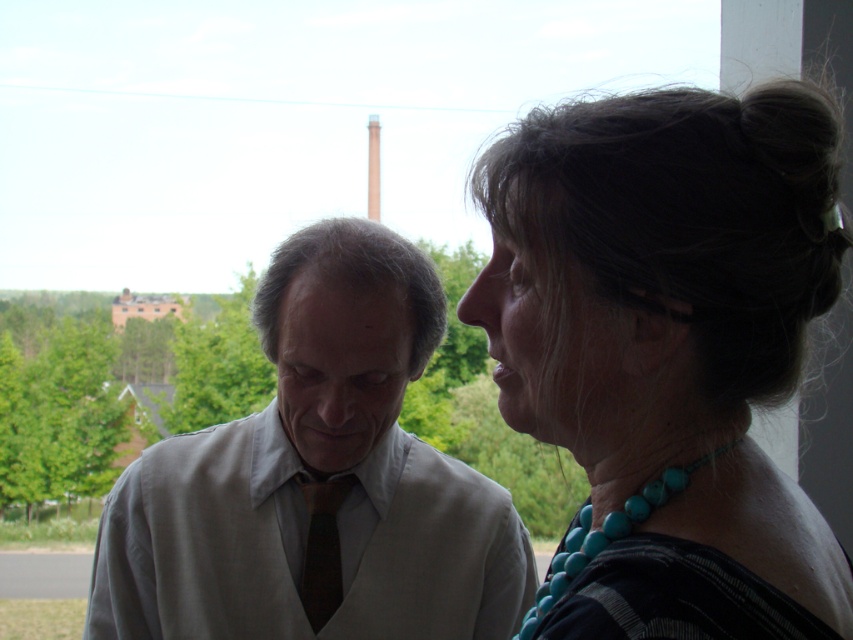
Question: Is turquoise beaded necklace at upper right thinner than light beige fabric shirt at center?

Choices:
 (A) yes
 (B) no

Answer: (A)

Question: Is turquoise beaded necklace at upper right wider than turquoise beads at right?

Choices:
 (A) no
 (B) yes

Answer: (B)

Question: Based on their relative distances, which object is nearer to the light beige fabric shirt at center?

Choices:
 (A) dark brown silk tie at center
 (B) turquoise beaded necklace at upper right
 (C) turquoise beads at right

Answer: (A)

Question: Which point is closer to the camera?

Choices:
 (A) dark brown silk tie at center
 (B) turquoise beads at right

Answer: (B)

Question: Does light beige fabric shirt at center have a lesser width compared to dark brown silk tie at center?

Choices:
 (A) no
 (B) yes

Answer: (A)

Question: Among these points, which one is nearest to the camera?

Choices:
 (A) (602, 541)
 (B) (709, 310)

Answer: (B)